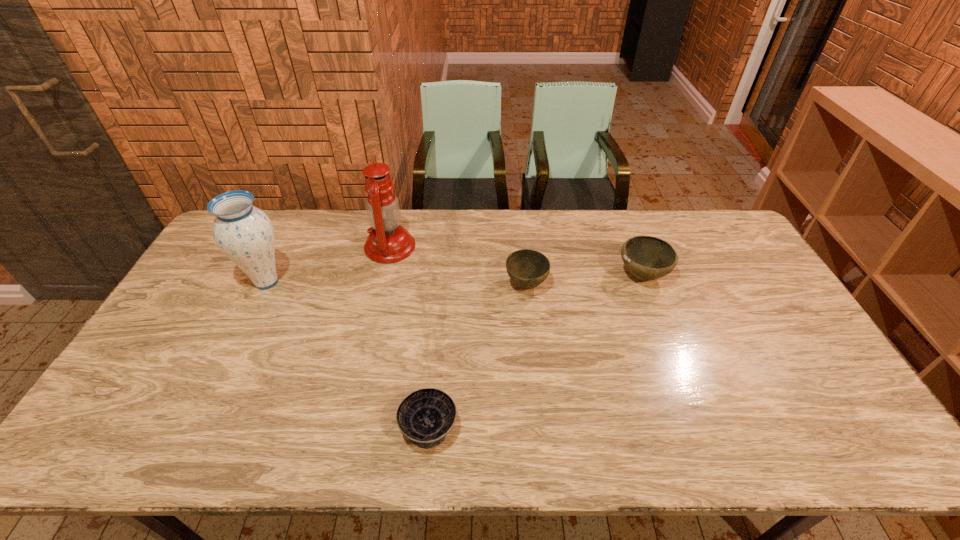
Where is `object that stands as the second closest to the rightmost object`? The width and height of the screenshot is (960, 540). object that stands as the second closest to the rightmost object is located at coordinates (426, 416).

The height and width of the screenshot is (540, 960). What are the coordinates of `the closest bowl relative to the rightmost bowl` in the screenshot? It's located at (527, 268).

At what (x,y) coordinates should I click in order to perform the action: click on bowl that stands as the second closest to the rightmost object. Please return your answer as a coordinate pair (x, y). The image size is (960, 540). Looking at the image, I should click on (426, 416).

I want to click on vacant space that satisfies the following two spatial constraints: 1. on the front side of the third object from right to left; 2. on the left side of the second object from left to right, so click(349, 427).

Locate an element on the screen. The height and width of the screenshot is (540, 960). free space that satisfies the following two spatial constraints: 1. on the back side of the rightmost object; 2. on the left side of the second bowl from left to right is located at coordinates (525, 275).